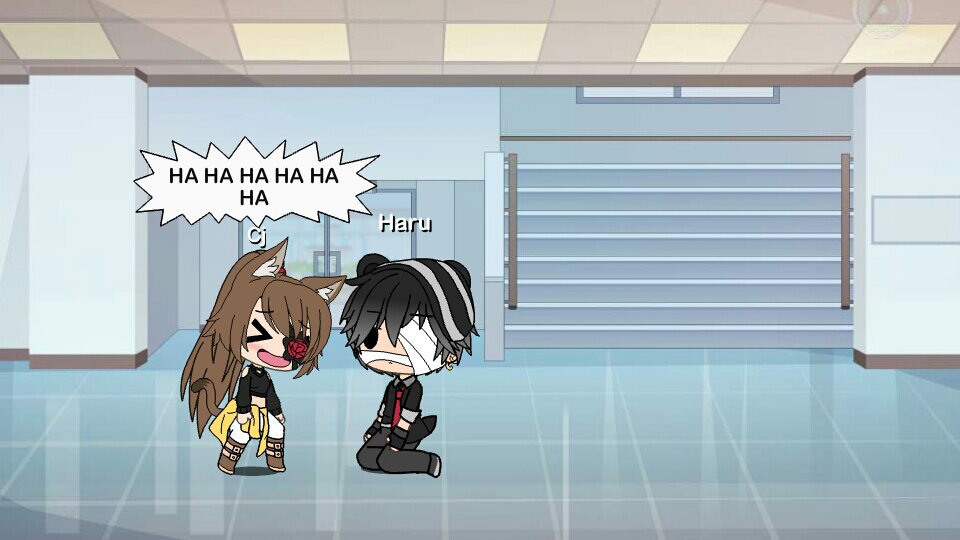
Locate an element on the screen. stairs is located at coordinates (609, 298).